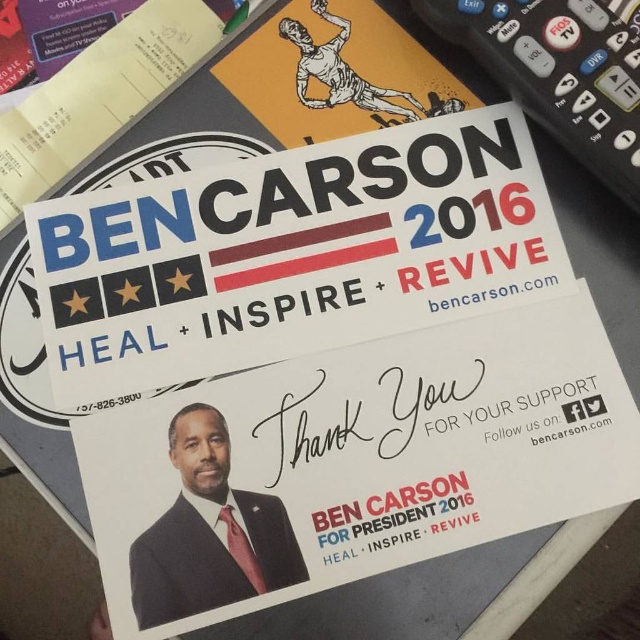
Question: Can you confirm if black plastic remote at upper right is positioned above matte black suit at center?

Choices:
 (A) no
 (B) yes

Answer: (B)

Question: Can you confirm if black plastic remote at upper right is thinner than matte black suit at center?

Choices:
 (A) no
 (B) yes

Answer: (A)

Question: Which point is closer to the camera?

Choices:
 (A) matte black suit at center
 (B) black plastic remote at upper right

Answer: (A)

Question: Is black plastic remote at upper right above matte black suit at center?

Choices:
 (A) yes
 (B) no

Answer: (A)

Question: Which point is farther from the camera taking this photo?

Choices:
 (A) (634, 102)
 (B) (180, 548)

Answer: (A)

Question: Which point appears farthest from the camera in this image?

Choices:
 (A) (573, 76)
 (B) (209, 566)

Answer: (A)